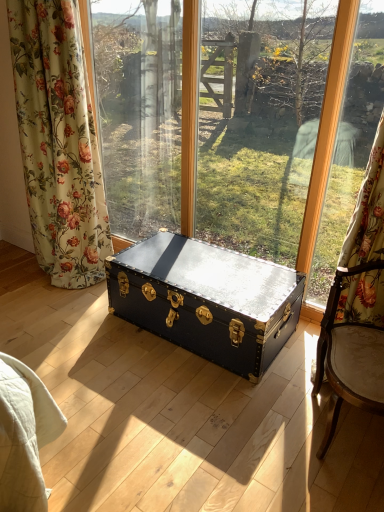
Question: Is floral fabric curtain at left thinner than wooden frame at right?

Choices:
 (A) no
 (B) yes

Answer: (A)

Question: From the image's perspective, does floral fabric curtain at left appear lower than wooden frame at right?

Choices:
 (A) yes
 (B) no

Answer: (B)

Question: From a real-world perspective, is floral fabric curtain at left positioned under wooden frame at right based on gravity?

Choices:
 (A) yes
 (B) no

Answer: (B)

Question: Could you tell me if floral fabric curtain at left is turned towards wooden frame at right?

Choices:
 (A) yes
 (B) no

Answer: (B)

Question: Is floral fabric curtain at left facing away from wooden frame at right?

Choices:
 (A) no
 (B) yes

Answer: (A)

Question: Considering the positions of wooden frame at right and shiny black trunk at center in the image, is wooden frame at right bigger or smaller than shiny black trunk at center?

Choices:
 (A) small
 (B) big

Answer: (A)

Question: In terms of width, does wooden frame at right look wider or thinner when compared to shiny black trunk at center?

Choices:
 (A) thin
 (B) wide

Answer: (A)

Question: Considering the positions of point (367, 23) and point (296, 316), is point (367, 23) closer or farther from the camera than point (296, 316)?

Choices:
 (A) closer
 (B) farther

Answer: (A)

Question: Do you think wooden frame at right is within shiny black trunk at center, or outside of it?

Choices:
 (A) inside
 (B) outside

Answer: (B)

Question: Considering the positions of point (342, 302) and point (324, 229), is point (342, 302) closer or farther from the camera than point (324, 229)?

Choices:
 (A) closer
 (B) farther

Answer: (A)

Question: Relative to wooden frame at right, is matte black trunk at center in front or behind?

Choices:
 (A) behind
 (B) front

Answer: (A)

Question: From the image's perspective, is matte black trunk at center positioned above or below wooden frame at right?

Choices:
 (A) above
 (B) below

Answer: (A)

Question: Based on their positions, is matte black trunk at center located to the left or right of wooden frame at right?

Choices:
 (A) right
 (B) left

Answer: (B)

Question: From the image's perspective, is shiny black trunk at center located above or below matte black trunk at center?

Choices:
 (A) below
 (B) above

Answer: (A)

Question: Considering the positions of point (274, 287) and point (294, 32), is point (274, 287) closer or farther from the camera than point (294, 32)?

Choices:
 (A) closer
 (B) farther

Answer: (A)